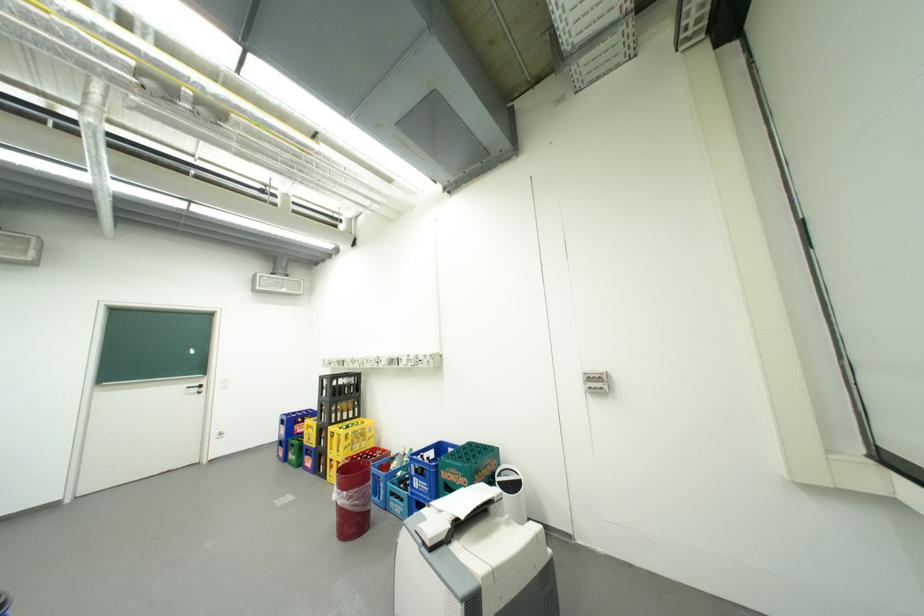
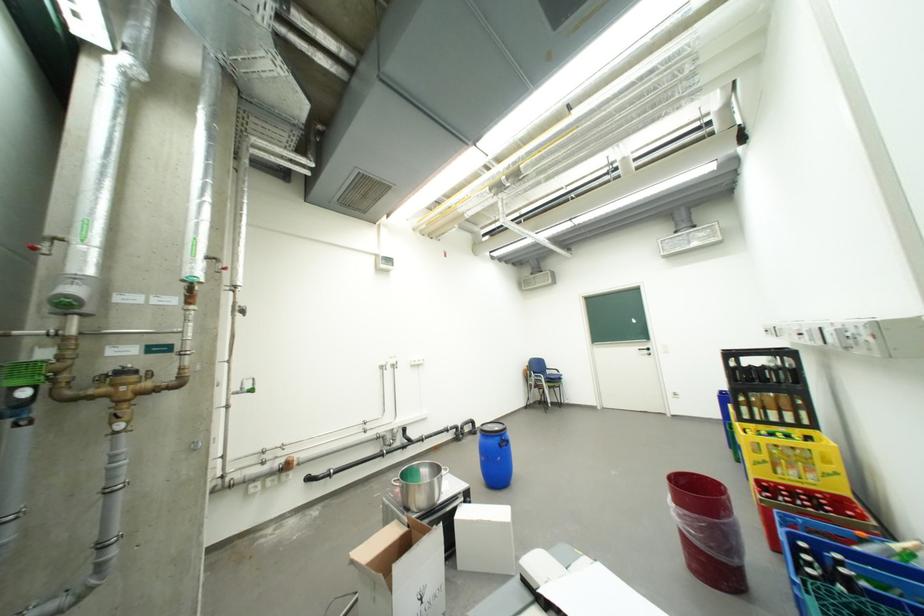
Where in the second image is the point corresponding to point (356, 493) from the first image?

(685, 507)